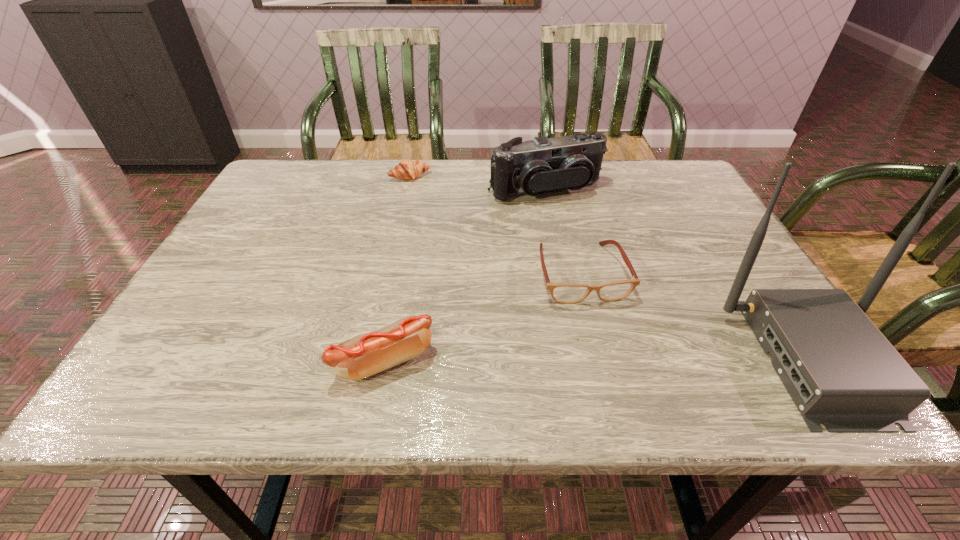
Locate an element on the screen. free location located on the front-facing side of the spectacles is located at coordinates (611, 353).

Where is `vacant space located 0.060m on the front-facing side of the spectacles`? This screenshot has width=960, height=540. vacant space located 0.060m on the front-facing side of the spectacles is located at coordinates (601, 328).

Where is `free space located 0.360m on the front-facing side of the shortest object`? The image size is (960, 540). free space located 0.360m on the front-facing side of the shortest object is located at coordinates (469, 255).

Identify the location of free space located 0.260m on the front-facing side of the shortest object. (453, 231).

At what (x,y) coordinates should I click in order to perform the action: click on vacant area situated 0.240m on the front-facing side of the shortest object. Please return your answer as a coordinate pair (x, y). This screenshot has height=540, width=960. Looking at the image, I should click on (450, 227).

Identify the location of camcorder present at the far edge. The height and width of the screenshot is (540, 960). (542, 165).

Where is `pastry present at the far edge`? pastry present at the far edge is located at coordinates click(407, 169).

Image resolution: width=960 pixels, height=540 pixels. Find the location of `sausage that is at the near edge`. sausage that is at the near edge is located at coordinates (362, 356).

You are a GUI agent. You are given a task and a screenshot of the screen. Output one action in this format:
    pyautogui.click(x=<x>, y=<y>)
    Task: Click on the router situated at the near edge
    The image size is (960, 540).
    Given the screenshot: What is the action you would take?
    pyautogui.click(x=840, y=370)

Locate an element on the screen. object located in the right edge section of the desktop is located at coordinates tap(840, 370).